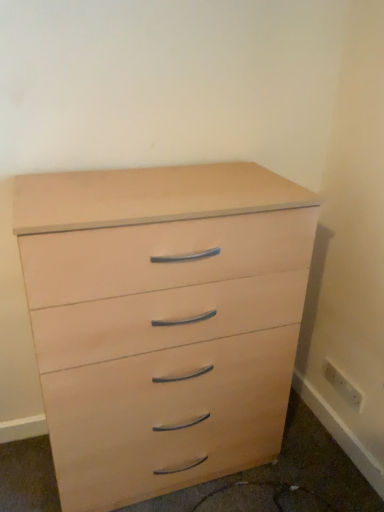
Describe the element at coordinates (163, 320) in the screenshot. I see `light wood/veneer chest of drawers at center` at that location.

Where is `light wood drawer at lower right`? light wood drawer at lower right is located at coordinates (167, 418).

Is light wood/veneer chest of drawers at center inside or outside of light wood drawer at lower right?

light wood/veneer chest of drawers at center is spatially situated outside light wood drawer at lower right.

Based on the photo, considering the relative sizes of light wood/veneer chest of drawers at center and light wood drawer at lower right in the image provided, is light wood/veneer chest of drawers at center bigger than light wood drawer at lower right?

Yes, light wood/veneer chest of drawers at center is bigger than light wood drawer at lower right.

Can you confirm if light wood/veneer chest of drawers at center is shorter than light wood drawer at lower right?

In fact, light wood/veneer chest of drawers at center may be taller than light wood drawer at lower right.

Looking at this image, is light wood/veneer chest of drawers at center far away from light wood drawer at lower right?

light wood/veneer chest of drawers at center is near light wood drawer at lower right, not far away.

Consider the image. Are white plastic electric outlet at lower right and light wood drawer at lower right located far from each other?

They are positioned close to each other.

In the scene shown: Who is more distant, white plastic electric outlet at lower right or light wood drawer at lower right?

white plastic electric outlet at lower right is further away from the camera.

Could you tell me if white plastic electric outlet at lower right is facing light wood drawer at lower right?

No, white plastic electric outlet at lower right is not turned towards light wood drawer at lower right.

Is white plastic electric outlet at lower right outside of light wood drawer at lower right?

That's correct, white plastic electric outlet at lower right is outside of light wood drawer at lower right.

From a real-world perspective, is light wood drawer at lower right physically below white plastic electric outlet at lower right?

Yes, from a real-world perspective, light wood drawer at lower right is under white plastic electric outlet at lower right.

Is light wood drawer at lower right bigger or smaller than white plastic electric outlet at lower right?

Considering their sizes, light wood drawer at lower right takes up more space than white plastic electric outlet at lower right.

Is light wood drawer at lower right far from white plastic electric outlet at lower right?

Actually, light wood drawer at lower right and white plastic electric outlet at lower right are a little close together.

Does light wood/veneer chest of drawers at center have a smaller size compared to white plastic electric outlet at lower right?

No.

From a real-world perspective, which is physically above, light wood/veneer chest of drawers at center or white plastic electric outlet at lower right?

light wood/veneer chest of drawers at center.

There is a white plastic electric outlet at lower right. Identify the location of the chest of drawers above it (from a real-world perspective). This screenshot has height=512, width=384. (163, 320).

Is light wood/veneer chest of drawers at center not near white plastic electric outlet at lower right?

No, light wood/veneer chest of drawers at center is not far from white plastic electric outlet at lower right.

Is light wood drawer at lower right taller than light wood/veneer chest of drawers at center?

In fact, light wood drawer at lower right may be shorter than light wood/veneer chest of drawers at center.

Looking at this image, measure the distance between light wood drawer at lower right and light wood/veneer chest of drawers at center.

A distance of 8.72 centimeters exists between light wood drawer at lower right and light wood/veneer chest of drawers at center.

Does point (285, 347) come farther from viewer compared to point (95, 408)?

Yes.

Which is more to the right, white plastic electric outlet at lower right or light wood/veneer chest of drawers at center?

From the viewer's perspective, white plastic electric outlet at lower right appears more on the right side.

How many degrees apart are the facing directions of white plastic electric outlet at lower right and light wood/veneer chest of drawers at center?

90.3 degrees separate the facing orientations of white plastic electric outlet at lower right and light wood/veneer chest of drawers at center.

Are white plastic electric outlet at lower right and light wood/veneer chest of drawers at center far apart?

No, there isn't a large distance between white plastic electric outlet at lower right and light wood/veneer chest of drawers at center.

From a real-world perspective, is white plastic electric outlet at lower right physically located above or below light wood/veneer chest of drawers at center?

In terms of real-world spatial position, white plastic electric outlet at lower right is below light wood/veneer chest of drawers at center.

The width and height of the screenshot is (384, 512). I want to click on drawer on the right of light wood/veneer chest of drawers at center, so coord(167,418).

Locate an element on the screen. drawer in front of the white plastic electric outlet at lower right is located at coordinates (167, 418).

Based on their spatial positions, is light wood drawer at lower right or white plastic electric outlet at lower right closer to light wood/veneer chest of drawers at center?

The object closer to light wood/veneer chest of drawers at center is light wood drawer at lower right.

From the picture: Considering their positions, is light wood/veneer chest of drawers at center positioned closer to light wood drawer at lower right than white plastic electric outlet at lower right?

The object closer to light wood drawer at lower right is light wood/veneer chest of drawers at center.

When comparing their distances from light wood/veneer chest of drawers at center, does white plastic electric outlet at lower right or light wood drawer at lower right seem further?

Based on the image, white plastic electric outlet at lower right appears to be further to light wood/veneer chest of drawers at center.

Considering their positions, is light wood/veneer chest of drawers at center positioned further to white plastic electric outlet at lower right than light wood drawer at lower right?

Based on the image, light wood/veneer chest of drawers at center appears to be further to white plastic electric outlet at lower right.

Looking at the image, which one is located further to white plastic electric outlet at lower right, light wood drawer at lower right or light wood/veneer chest of drawers at center?

light wood/veneer chest of drawers at center.

Which object lies nearer to the anchor point light wood drawer at lower right, white plastic electric outlet at lower right or light wood/veneer chest of drawers at center?

light wood/veneer chest of drawers at center is closer to light wood drawer at lower right.

In order to click on drawer between light wood/veneer chest of drawers at center and white plastic electric outlet at lower right from left to right in this screenshot , I will do [x=167, y=418].